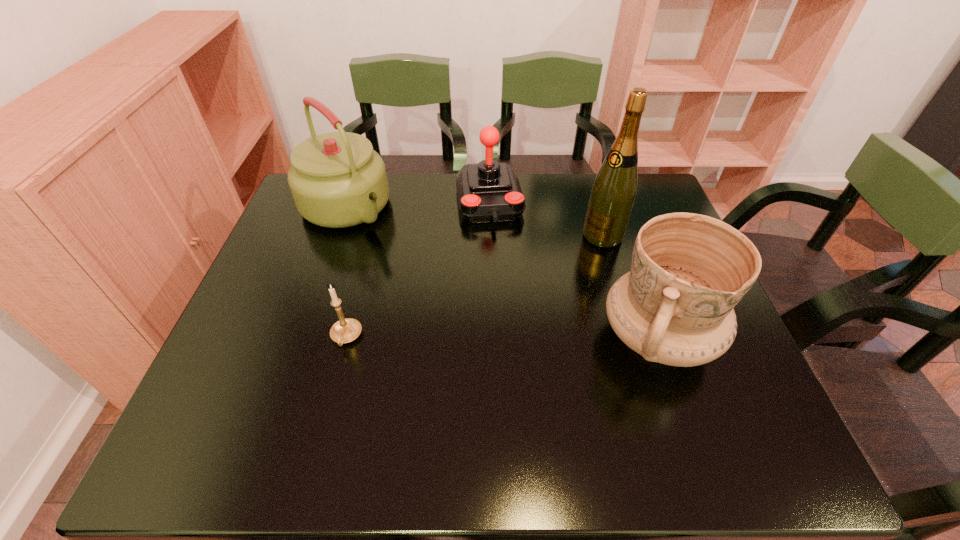
Identify the location of vacant space on the desktop that is between the candle holder and the third tallest object and is positioned on the base of the third object from right to left. (515, 338).

At what (x,y) coordinates should I click in order to perform the action: click on free space on the desktop that is between the candle holder and the third shortest object and is positioned on the front-facing side of the tallest object. Please return your answer as a coordinate pair (x, y). Looking at the image, I should click on (463, 338).

The height and width of the screenshot is (540, 960). Find the location of `vacant space on the desktop that is between the shortest object and the pottery and is positioned at the spout of the kettle`. vacant space on the desktop that is between the shortest object and the pottery and is positioned at the spout of the kettle is located at coordinates (481, 338).